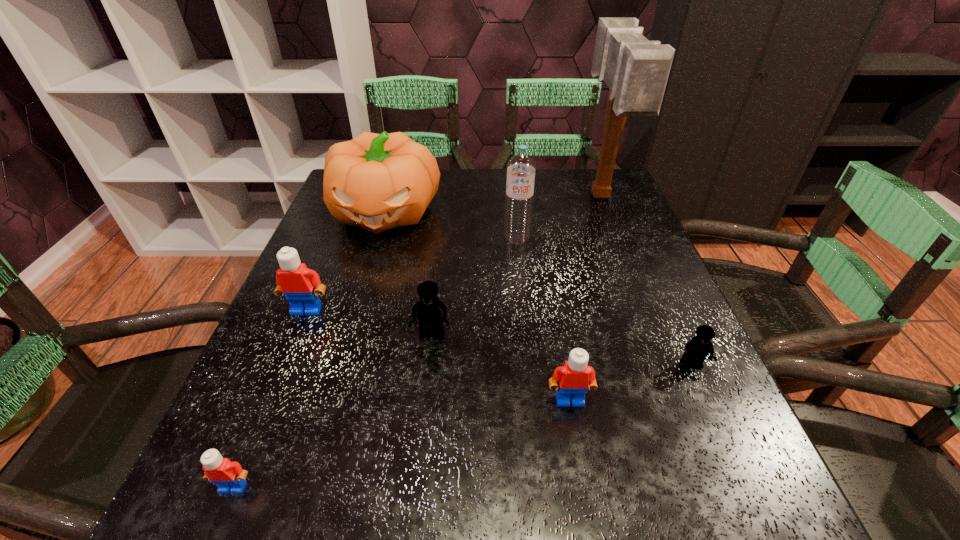
Where is `free space between the pumpkin and the water bottle`? Image resolution: width=960 pixels, height=540 pixels. free space between the pumpkin and the water bottle is located at coordinates (451, 225).

Where is `blank region between the second nearest white Lego and the fifth nearest object`? Image resolution: width=960 pixels, height=540 pixels. blank region between the second nearest white Lego and the fifth nearest object is located at coordinates (438, 355).

This screenshot has height=540, width=960. What are the coordinates of `vacant area that lies between the tallest Lego and the water bottle` in the screenshot? It's located at (412, 274).

The height and width of the screenshot is (540, 960). I want to click on vacant space that's between the pumpkin and the left yellow Lego, so click(x=408, y=273).

Find the location of a particular element. The height and width of the screenshot is (540, 960). vacant area between the tallest object and the tallest Lego is located at coordinates (453, 254).

Locate an element on the screen. The width and height of the screenshot is (960, 540). object that is the third closest to the rightmost white Lego is located at coordinates (521, 167).

Locate an element on the screen. the seventh closest object to the second nearest white Lego is located at coordinates (636, 70).

At what (x,y) coordinates should I click in order to perform the action: click on Lego that is the fifth closest to the pumpkin. Please return your answer as a coordinate pair (x, y). Image resolution: width=960 pixels, height=540 pixels. Looking at the image, I should click on (698, 348).

This screenshot has width=960, height=540. Identify the location of Lego that is the fifth closest to the tallest object. (229, 476).

At what (x,y) coordinates should I click in order to perform the action: click on white Lego that is the nearest to the bigger yellow Lego. Please return your answer as a coordinate pair (x, y). Looking at the image, I should click on (296, 282).